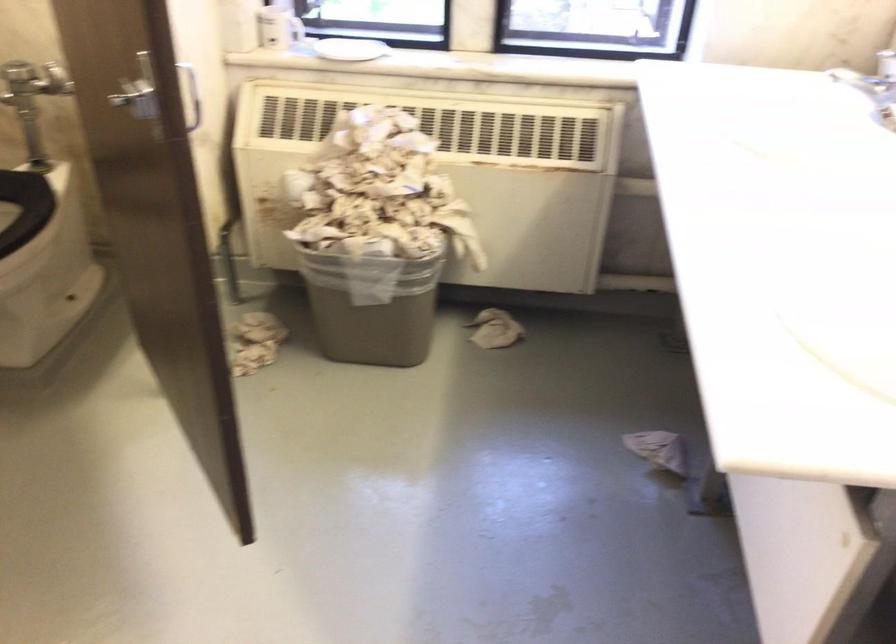
Describe the element at coordinates (32, 80) in the screenshot. This screenshot has width=896, height=644. I see `a toilet flush handle` at that location.